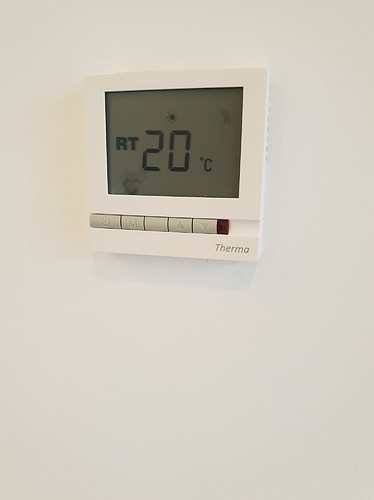
The height and width of the screenshot is (500, 374). Find the location of `thermostat`. thermostat is located at coordinates (225, 195).